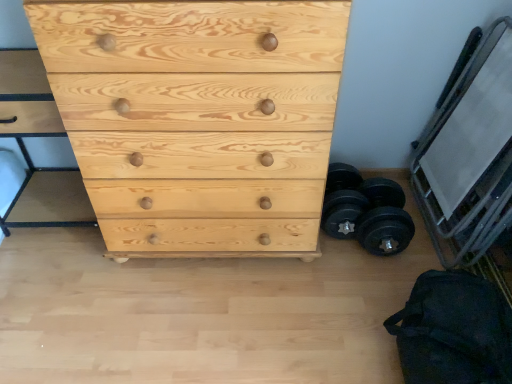
Question: From their relative heights in the image, would you say black fabric bag at lower right is taller or shorter than natural wood chest of drawers at center?

Choices:
 (A) tall
 (B) short

Answer: (B)

Question: From the image's perspective, relative to natural wood chest of drawers at center, is black fabric bag at lower right above or below?

Choices:
 (A) above
 (B) below

Answer: (B)

Question: Which object is the closest to the metallic silver bunk bed at right?

Choices:
 (A) black fabric bag at lower right
 (B) natural wood chest of drawers at center
 (C) black rubber dumbbell at lower right

Answer: (C)

Question: Which is nearer to the metallic silver bunk bed at right?

Choices:
 (A) black fabric bag at lower right
 (B) natural wood chest of drawers at center
 (C) black rubber dumbbell at lower right

Answer: (C)